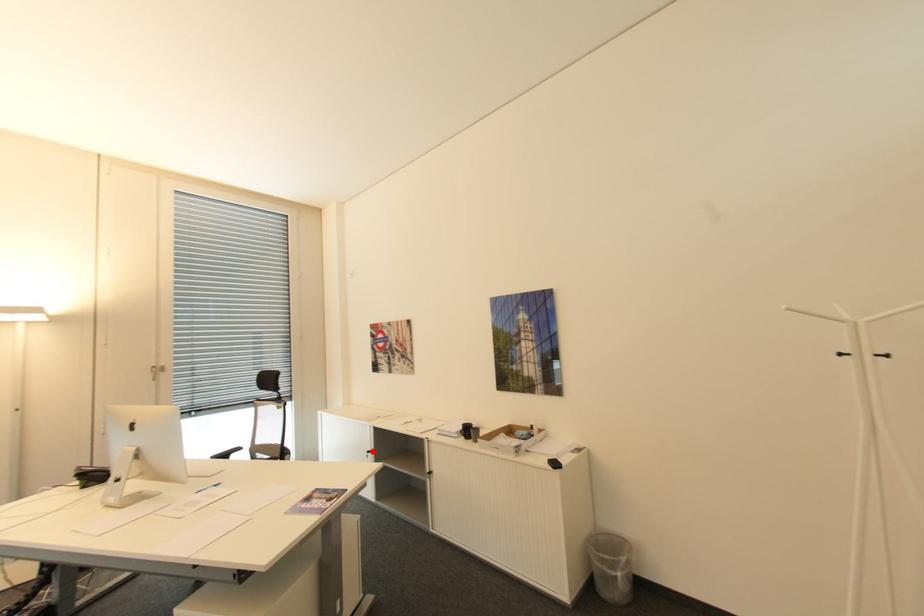
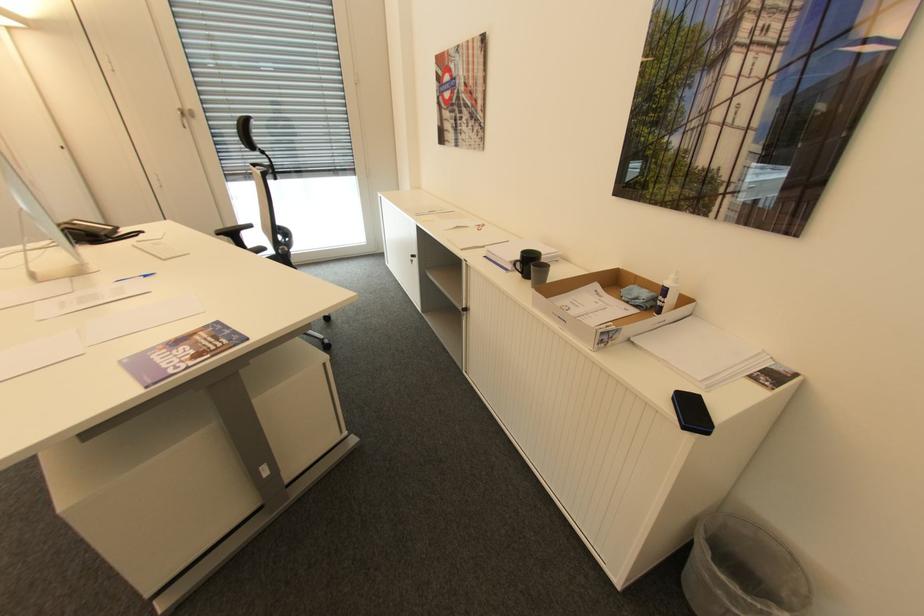
Question: I am providing you with two images of the same scene from different viewpoints. A red point is marked on the first image. Is the red point's position out of view in image 2?

Choices:
 (A) Yes
 (B) No

Answer: (B)